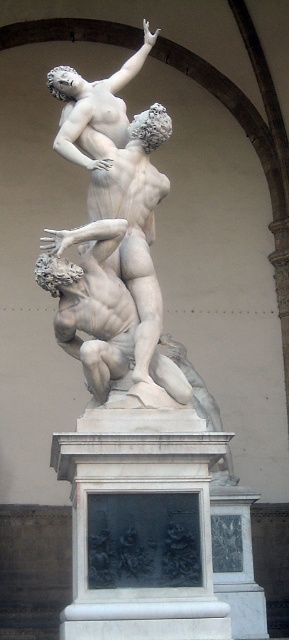
Looking at this image, you are an art student analyzing the composition of the sculpture group. You notice the white marble relief at center and the white marble statue at upper center. Which one appears nearer to you in the artwork?

The white marble relief at center is closer to the viewer than the white marble statue at upper center, so the relief appears nearer in the artwork.

What are the coordinates of the white marble relief at center?

The coordinates of the white marble relief at center are at point [141,534].

You are an art conservator assessing the space required to transport both the white marble relief at center and the white marble statue at center. Based on their dimensions, which object requires more horizontal space for transportation?

The white marble relief at center is wider than the white marble statue at center, so it requires more horizontal space for transportation.